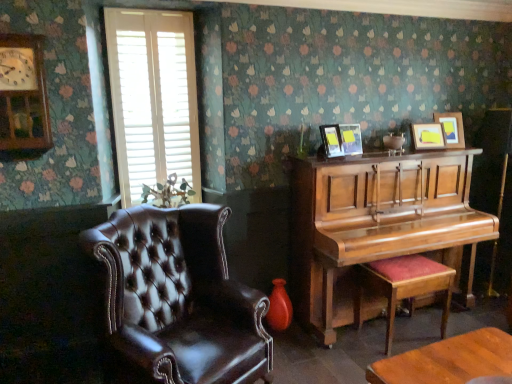
Identify the location of vacant space in matte wooden picture frame at upper right, which ranks as the second picture frame in right-to-left order (from a real-world perspective). (428, 153).